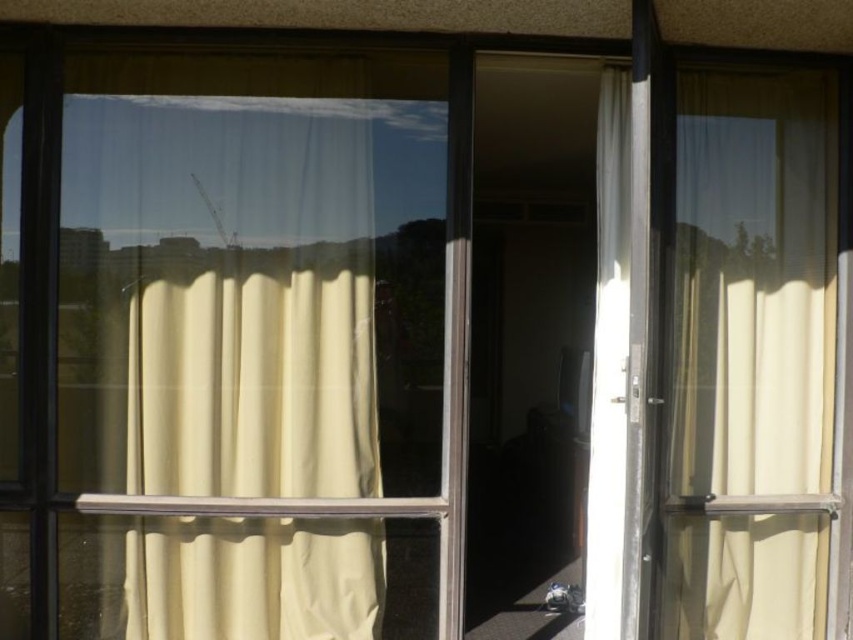
Is white sheer curtain at left smaller than white sheer curtain at center?

Correct, white sheer curtain at left occupies less space than white sheer curtain at center.

Is point (305, 612) more distant than point (625, 369)?

Yes, it is behind point (625, 369).

Identify the location of white sheer curtain at left. (247, 294).

Looking at this image, is white sheer curtain at left to the left of beige sheer curtain at right from the viewer's perspective?

Correct, you'll find white sheer curtain at left to the left of beige sheer curtain at right.

Who is more forward, [373,541] or [747,330]?

Point [373,541] is more forward.

This screenshot has height=640, width=853. I want to click on white sheer curtain at left, so click(x=247, y=294).

Is beige sheer curtain at right smaller than white sheer curtain at center?

Yes.

Between point (679, 474) and point (604, 394), which one is positioned behind?

Positioned behind is point (679, 474).

Between point (784, 378) and point (621, 280), which one is positioned in front?

Positioned in front is point (621, 280).

The image size is (853, 640). I want to click on beige sheer curtain at right, so click(753, 282).